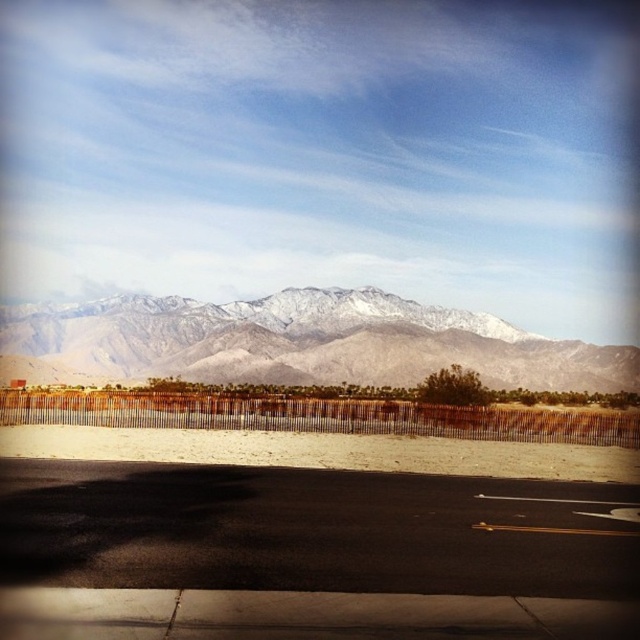
Question: Does black asphalt road at lower center come in front of snowy gray mountain range at upper center?

Choices:
 (A) yes
 (B) no

Answer: (A)

Question: Is black asphalt road at lower center wider than snowy gray mountain range at upper center?

Choices:
 (A) yes
 (B) no

Answer: (B)

Question: Which of the following is the farthest from the observer?

Choices:
 (A) black asphalt road at lower center
 (B) snowy gray mountain range at upper center

Answer: (B)

Question: Among these objects, which one is farthest from the camera?

Choices:
 (A) black asphalt road at lower center
 (B) snowy gray mountain range at upper center

Answer: (B)

Question: Among these objects, which one is farthest from the camera?

Choices:
 (A) snowy gray mountain range at upper center
 (B) black asphalt road at lower center

Answer: (A)

Question: Can you confirm if black asphalt road at lower center is positioned below snowy gray mountain range at upper center?

Choices:
 (A) yes
 (B) no

Answer: (A)